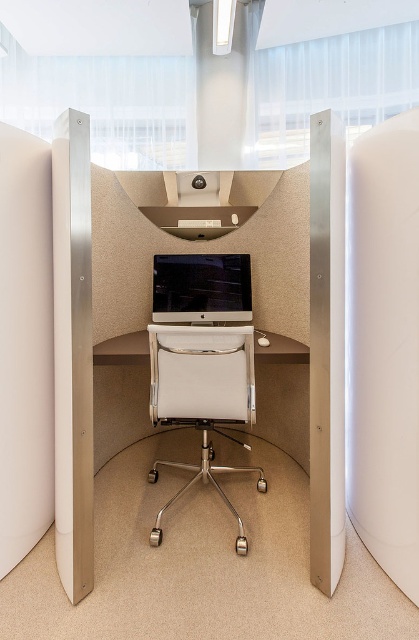
From the picture: You are sitting in the white leather swivel chair at center and want to look at the satin silver monitor at center. Which direction should you turn your head to see the monitor?

Since the white leather swivel chair at center is in front of the satin silver monitor at center, you would need to look straight ahead to see the monitor.

From the picture: You are an office worker who needs to place a new keyboard on your desk. The keyboard requires a minimum of 50 cm of space in front of the satin silver monitor at center. Given the size difference between the matte beige desk at center and the monitor, do you think there is enough space on the desk to accommodate the keyboard?

The matte beige desk at center is larger in size than the satin silver monitor at center, so there is likely sufficient space on the desk to place the keyboard 50 cm in front of the monitor.